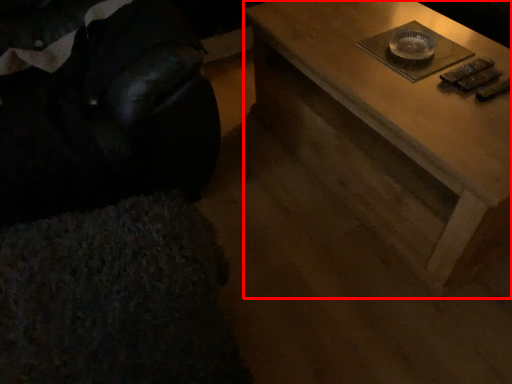
Question: From the image's perspective, what is the correct spatial positioning of table (annotated by the red box) in reference to bean bag chair?

Choices:
 (A) below
 (B) above

Answer: (A)